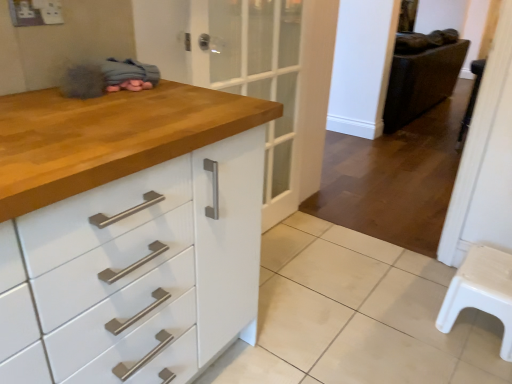
At what (x,y) coordinates should I click in order to perform the action: click on blank space to the left of white plastic step stool at right. Please return your answer as a coordinate pair (x, y). Image resolution: width=512 pixels, height=384 pixels. Looking at the image, I should click on (430, 146).